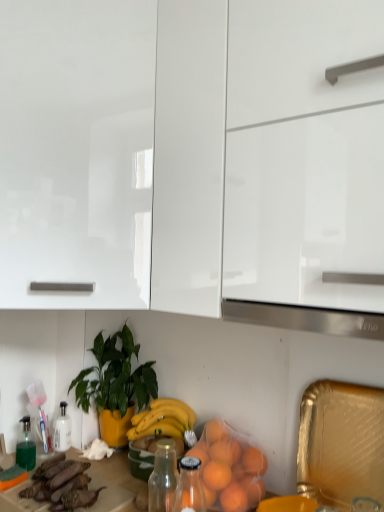
Question: From a real-world perspective, is orange matte plastic bag at lower center positioned above or below glossy white cabinet at upper left, the 2th cabinetry in the right-to-left sequence?

Choices:
 (A) below
 (B) above

Answer: (A)

Question: Considering their positions, is orange matte plastic bag at lower center located in front of or behind glossy white cabinet at upper left, which is the 1th cabinetry from left to right?

Choices:
 (A) behind
 (B) front

Answer: (A)

Question: Which of these objects is positioned farthest from the green translucent bottle at lower left?

Choices:
 (A) green glossy plant at center
 (B) glossy white cabinet at upper left, which is the 1th cabinetry from left to right
 (C) satin silver exhaust hood at center
 (D) purple matte eggplant at lower left
 (E) orange matte plastic bag at lower center

Answer: (C)

Question: Which object is the farthest from the glossy white cabinet at upper center, placed as the 1th cabinetry when sorted from right to left?

Choices:
 (A) satin silver exhaust hood at center
 (B) glossy white cabinet at upper left, the 2th cabinetry in the right-to-left sequence
 (C) green translucent bottle at lower left
 (D) orange matte plastic bag at lower center
 (E) green glossy plant at center

Answer: (C)